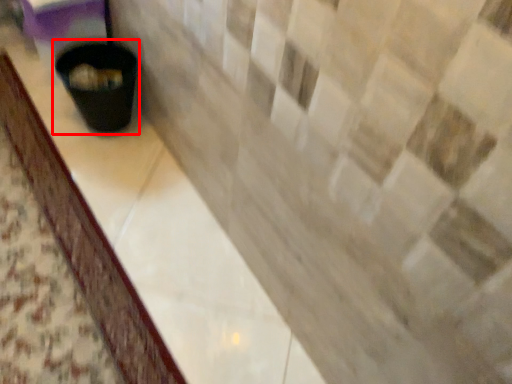
Question: From the image's perspective, what is the correct spatial relationship of waste container (annotated by the red box) in relation to counter top?

Choices:
 (A) below
 (B) above

Answer: (B)